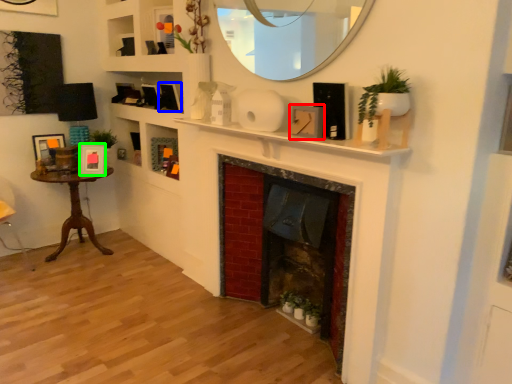
Question: Which is nearer to the picture frame (highlighted by a red box)? picture frame (highlighted by a blue box) or picture frame (highlighted by a green box).

Choices:
 (A) picture frame
 (B) picture frame

Answer: (A)